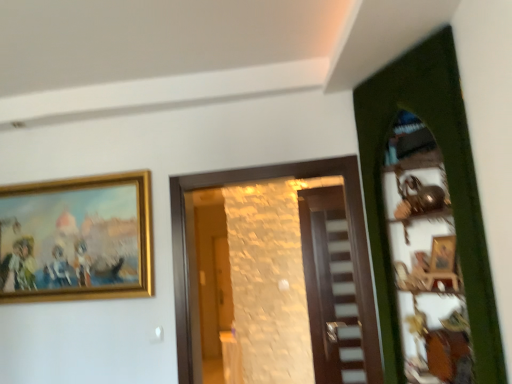
Find the location of a particular element. vacant space situated above gold/gilded picture frame at upper left (from a real-world perspective) is located at coordinates (67, 178).